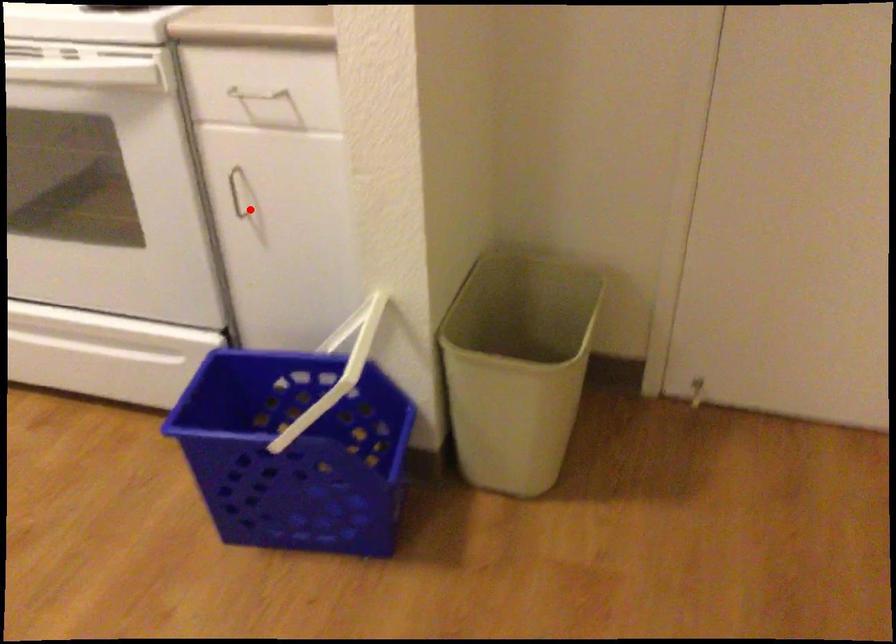
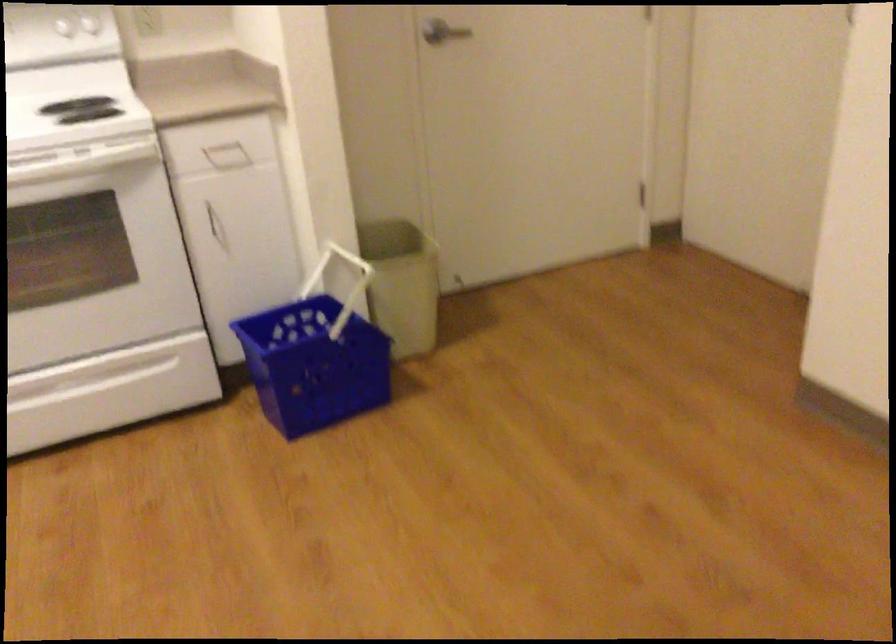
Question: I am providing you with two images of the same scene from different viewpoints. In image1, a red point is highlighted. Considering the same 3D point in image2, which of the following is correct?

Choices:
 (A) It is closer
 (B) It is farther

Answer: (B)